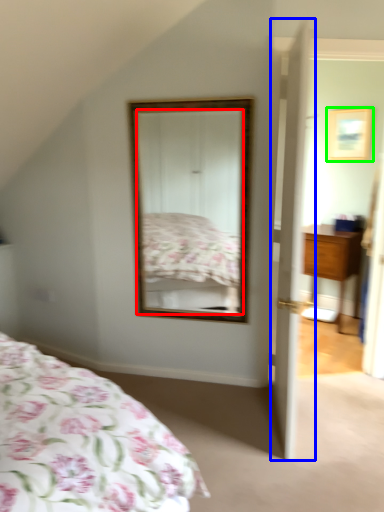
Question: Estimate the real-world distances between objects in this image. Which object is farther from mirror (highlighted by a red box), door (highlighted by a blue box) or picture frame (highlighted by a green box)?

Choices:
 (A) door
 (B) picture frame

Answer: (B)